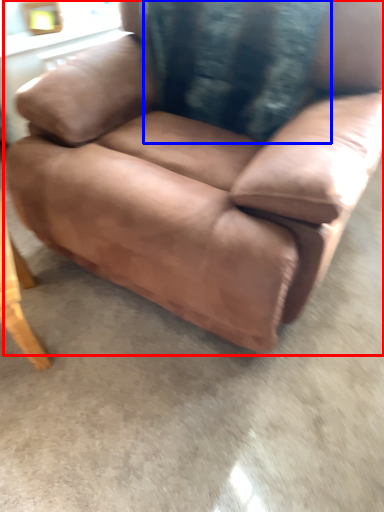
Question: Which point is further to the camera, chair (highlighted by a red box) or pillow (highlighted by a blue box)?

Choices:
 (A) chair
 (B) pillow

Answer: (B)